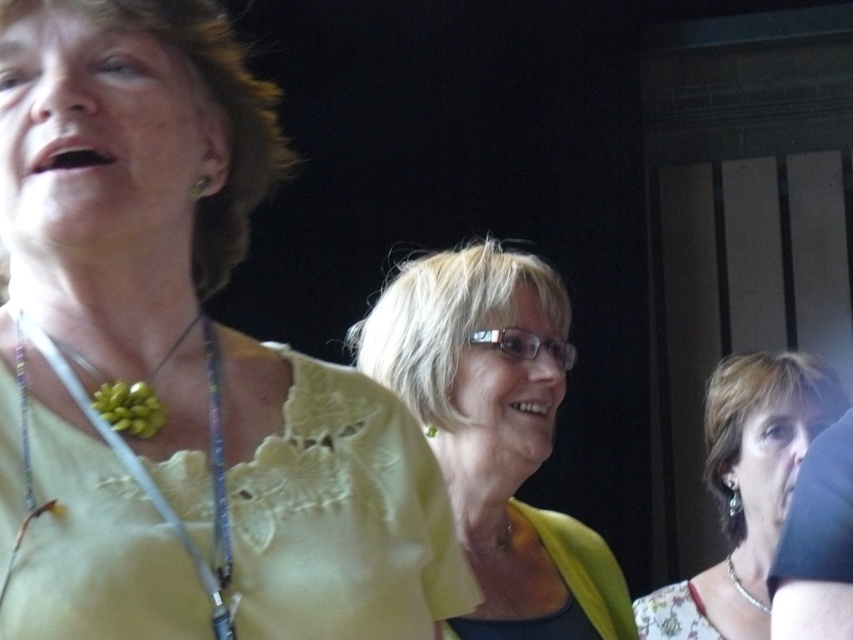
Question: Does light yellow fabric at center have a lesser width compared to green beaded necklace at left?

Choices:
 (A) no
 (B) yes

Answer: (A)

Question: Which is nearer to the silver metallic necklace at lower right?

Choices:
 (A) green textured pendant at center
 (B) floral fabric dress at lower right
 (C) light yellow fabric at center

Answer: (B)

Question: Which point is farther to the camera?

Choices:
 (A) (619, 636)
 (B) (289, 600)
 (C) (711, 616)
 (D) (201, 561)

Answer: (C)

Question: Is yellow fabric at upper left positioned behind green textured pendant at center?

Choices:
 (A) no
 (B) yes

Answer: (A)

Question: Estimate the real-world distances between objects in this image. Which object is closer to the silver metallic necklace at lower right?

Choices:
 (A) light yellow fabric at center
 (B) green beaded necklace at left
 (C) floral fabric dress at lower right
 (D) green textured pendant at center

Answer: (C)

Question: Can you confirm if green beaded necklace at left is thinner than green textured pendant at center?

Choices:
 (A) yes
 (B) no

Answer: (B)